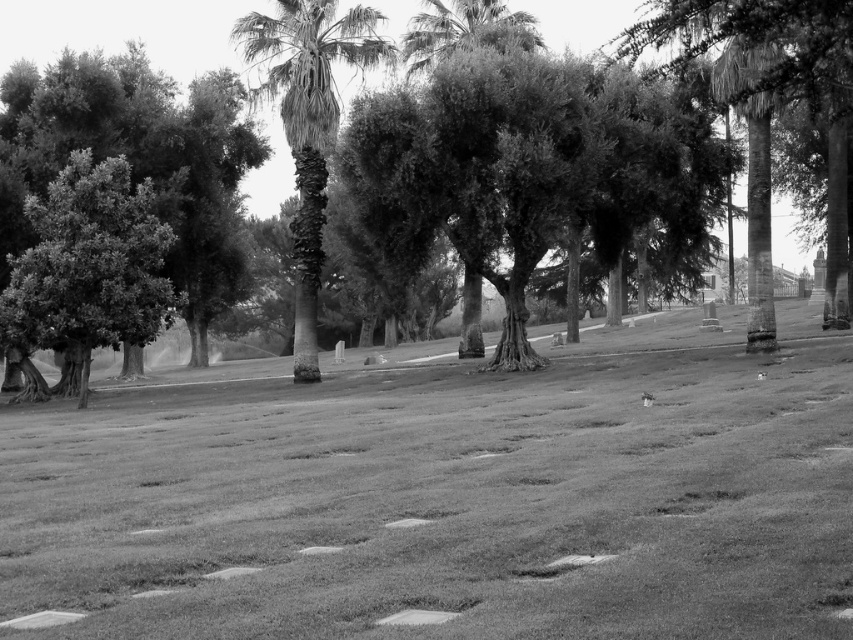
Can you confirm if grassy lawn at center is positioned below green leafy tree at center?

Yes.

Who is more forward, (326,614) or (554,33)?

Point (326,614)

Is point (761, 428) positioned before point (189, 56)?

Yes, point (761, 428) is in front of point (189, 56).

Identify the location of grassy lawn at center. (447, 496).

Can you confirm if grassy lawn at center is bigger than smooth bark palm tree at center?

No, grassy lawn at center is not bigger than smooth bark palm tree at center.

Is point (376, 476) closer to viewer compared to point (352, 36)?

Yes, it is.

Who is more forward, (531, 477) or (281, 17)?

Positioned in front is point (531, 477).

Find the location of `grassy lawn at center`. grassy lawn at center is located at coordinates (447, 496).

Does green leafy tree at center have a larger size compared to smooth bark palm tree at center?

Indeed, green leafy tree at center has a larger size compared to smooth bark palm tree at center.

Can you confirm if green leafy tree at center is shorter than smooth bark palm tree at center?

No.

Which is behind, point (515, 1) or point (364, 8)?

The point (515, 1) is behind.

Image resolution: width=853 pixels, height=640 pixels. In order to click on green leafy tree at center in this screenshot , I will do click(126, 29).